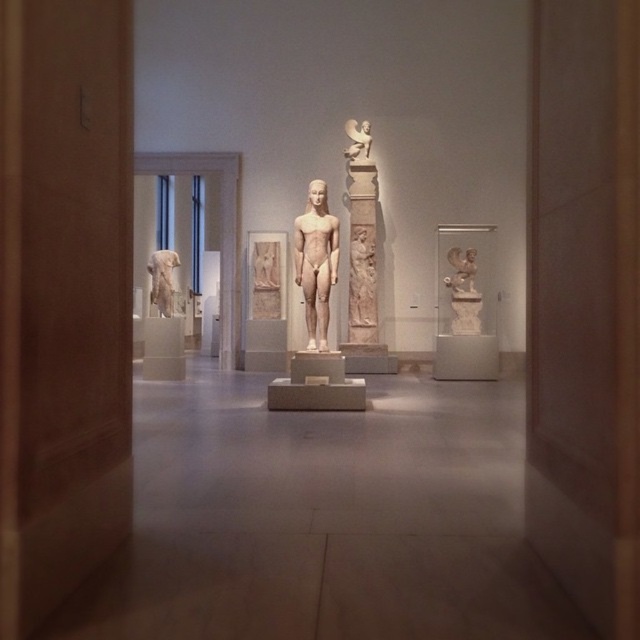
You are a tour guide explaining the layout of the museum exhibit. You want to mention the spatial relationship between the white marble statue at center and the white marble relief at upper center. How would you describe their positioning?

The white marble statue at center is positioned in front of the white marble relief at upper center, meaning the statue is closer to the viewer while the relief is situated behind it in the background.